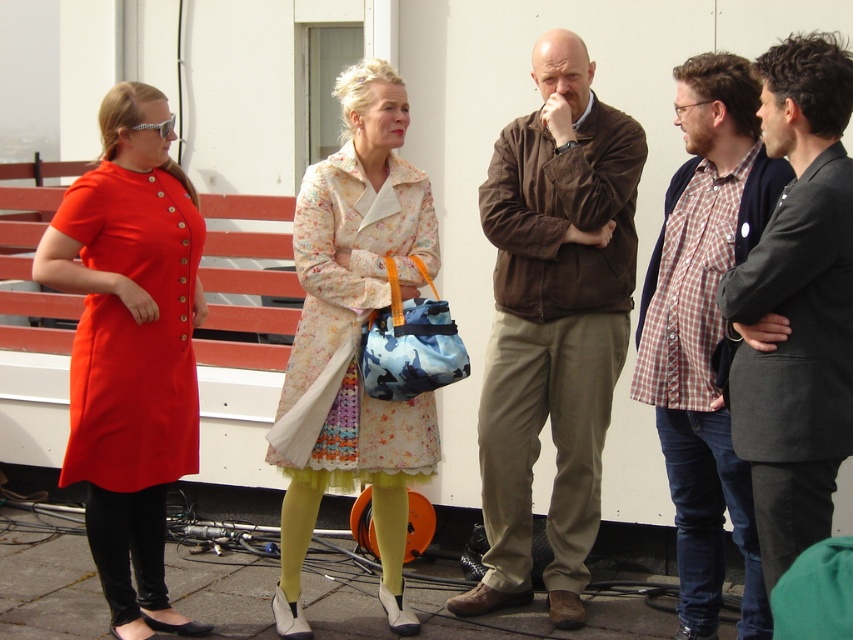
Does brown suede jacket at center have a lesser width compared to dark gray suit at right?

No.

Is brown suede jacket at center taller than dark gray suit at right?

Yes.

Between point (558, 196) and point (846, 186), which one is positioned in front?

Point (846, 186)

The width and height of the screenshot is (853, 640). I want to click on brown suede jacket at center, so click(553, 323).

Is dark gray suit at right taller than checkered fabric shirt at center?

No, dark gray suit at right is not taller than checkered fabric shirt at center.

Is dark gray suit at right positioned behind checkered fabric shirt at center?

No, it is in front of checkered fabric shirt at center.

The width and height of the screenshot is (853, 640). What are the coordinates of `dark gray suit at right` in the screenshot? It's located at (798, 304).

Is floral-patterned coat at center positioned before checkered fabric shirt at center?

That is False.

Is floral-patterned coat at center taller than checkered fabric shirt at center?

Correct, floral-patterned coat at center is much taller as checkered fabric shirt at center.

Locate an element on the screen. floral-patterned coat at center is located at coordinates (352, 339).